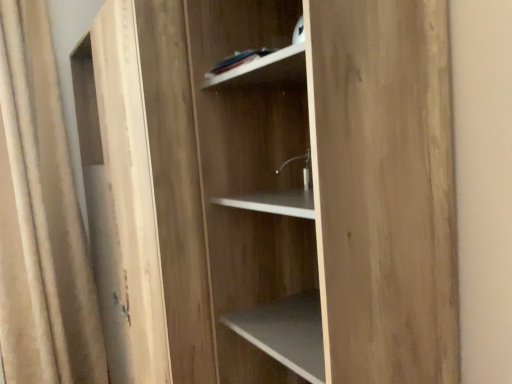
Question: Is beige fabric curtain at left next to white matte shelf at upper center and touching it?

Choices:
 (A) yes
 (B) no

Answer: (B)

Question: Is white matte shelf at upper center a part of beige fabric curtain at left?

Choices:
 (A) yes
 (B) no

Answer: (B)

Question: Considering the relative positions of beige fabric curtain at left and white matte shelf at upper center in the image provided, is beige fabric curtain at left behind white matte shelf at upper center?

Choices:
 (A) no
 (B) yes

Answer: (B)

Question: Is beige fabric curtain at left positioned beyond the bounds of white matte shelf at upper center?

Choices:
 (A) no
 (B) yes

Answer: (B)

Question: From the image's perspective, is beige fabric curtain at left under white matte shelf at upper center?

Choices:
 (A) no
 (B) yes

Answer: (B)

Question: Does beige fabric curtain at left appear on the right side of white matte shelf at upper center?

Choices:
 (A) yes
 (B) no

Answer: (B)

Question: Considering the relative positions of white matte shelf at upper center and light wood cabinet at center in the image provided, is white matte shelf at upper center to the right of light wood cabinet at center from the viewer's perspective?

Choices:
 (A) no
 (B) yes

Answer: (B)

Question: Does white matte shelf at upper center lie behind light wood cabinet at center?

Choices:
 (A) no
 (B) yes

Answer: (A)

Question: Does white matte shelf at upper center have a greater height compared to light wood cabinet at center?

Choices:
 (A) no
 (B) yes

Answer: (A)

Question: Is white matte shelf at upper center oriented away from light wood cabinet at center?

Choices:
 (A) no
 (B) yes

Answer: (A)

Question: Does white matte shelf at upper center have a lesser height compared to light wood cabinet at center?

Choices:
 (A) yes
 (B) no

Answer: (A)

Question: Is white matte shelf at upper center outside of light wood cabinet at center?

Choices:
 (A) yes
 (B) no

Answer: (A)

Question: Would you say beige fabric curtain at left is a long distance from light brown wood at center?

Choices:
 (A) yes
 (B) no

Answer: (A)